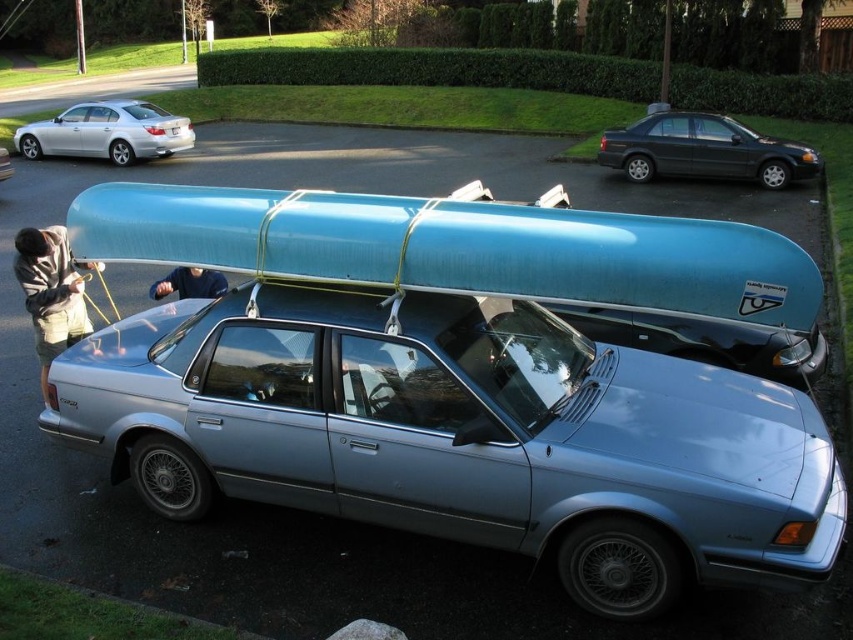
You are a delivery person trying to park your van behind the satin silver sedan at center and the dark blue shirt at upper center. Can you park your van behind both of them without moving either?

The satin silver sedan at center is taller than the dark blue shirt at upper center. Since the van needs to pass behind both objects, the tallest object determines the clearance. The satin silver sedan at center is taller, so if the van can clear its height, it can park behind both.

You are a delivery person trying to park your van next to the silver metallic sedan at upper left and the khaki shorts at lower left. Which vehicle will require more space in width to park next to?

The silver metallic sedan at upper left requires more space in width to park next to because its width is larger than the khaki shorts at lower left.

You are a delivery person trying to park your delivery van between the satin silver sedan at center and the khaki shorts at lower left. The van is 5 meters long. Is there enough space between them to park the van?

The satin silver sedan at center and khaki shorts at lower left are 2.23 meters apart. Since the van is 5 meters long, there is not enough space to park the van between them.